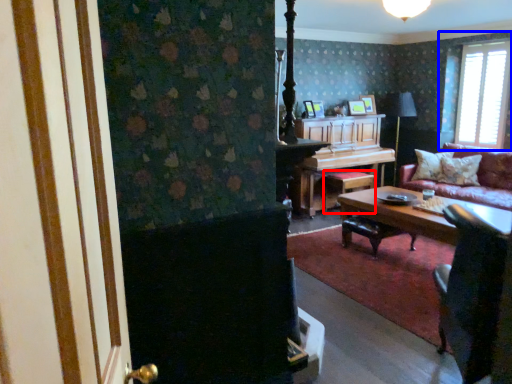
Question: Which object is closer to the camera taking this photo, stool (highlighted by a red box) or window (highlighted by a blue box)?

Choices:
 (A) stool
 (B) window

Answer: (B)